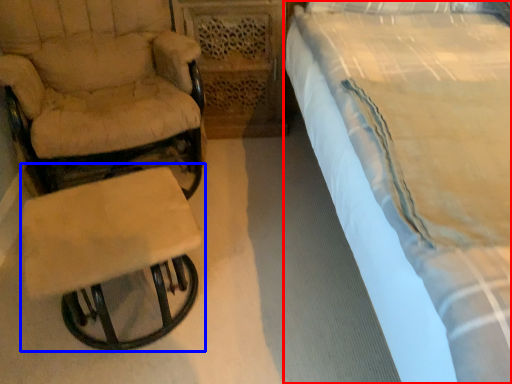
Question: Among these objects, which one is farthest to the camera, bed (highlighted by a red box) or table (highlighted by a blue box)?

Choices:
 (A) bed
 (B) table

Answer: (B)